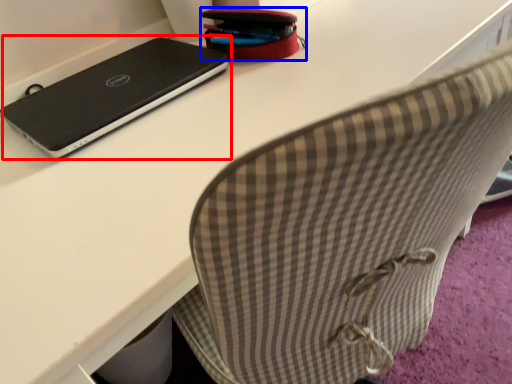
Question: Which object appears closest to the camera in this image, laptop (highlighted by a red box) or pencil case (highlighted by a blue box)?

Choices:
 (A) laptop
 (B) pencil case

Answer: (A)